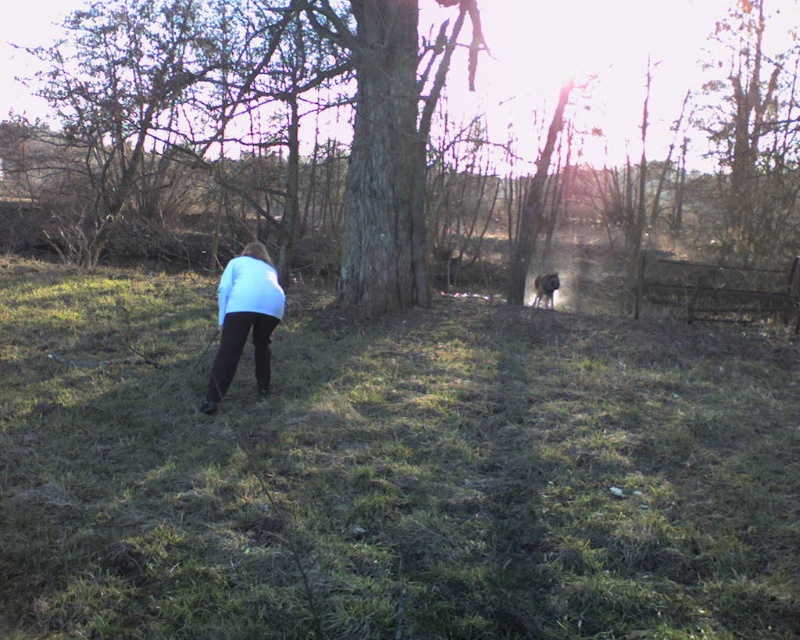
You are standing at the camera position and want to reach the light blue fabric at center without moving the camera. Is it possible to do so by just walking forward?

The light blue fabric at center and camera are 5.65 meters apart from each other, so yes, you can reach it by walking forward 5.65 meters.

You are a hiker who wants to place a tent on the green grassy at center without covering the light blue fabric at center. Is it possible to do so?

The green grassy at center is positioned on the right side of light blue fabric at center, so placing the tent on the green grassy at center would require ensuring it does not extend over to the light blue fabric at center. Since they are adjacent but distinct areas, it is possible as long as the tent is placed carefully on the grassy area without overlapping the fabric.

You are standing in the outdoor scene described. There is a rough bark tree at center and a brown fur dog at center. Which object is higher from the ground?

The rough bark tree at center is located above the brown fur dog at center, so the rough bark tree at center is higher from the ground.